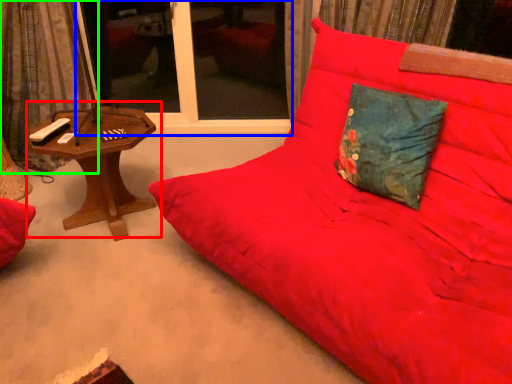
Question: Based on their relative distances, which object is farther from table (highlighted by a red box)? Choose from window screen (highlighted by a blue box) and curtain (highlighted by a green box).

Choices:
 (A) window screen
 (B) curtain

Answer: (A)